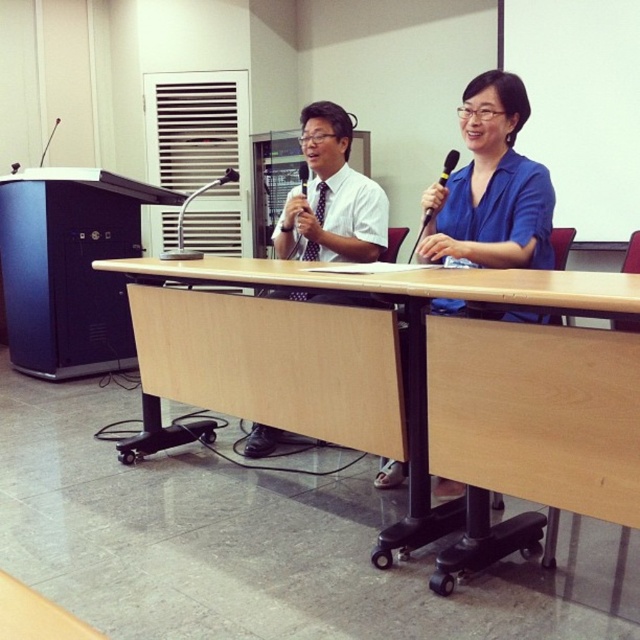
In the scene shown: You are an event planner setting up for a panel discussion. You need to ensure that the black plastic microphone at upper center is positioned so that it is directly above the light brown wood table at center. Is the current placement correct?

The light brown wood table at center is below the black plastic microphone at upper center, so the microphone is already positioned directly above the table.

You are attending a virtual meeting and need to adjust your camera to focus on the blue matte shirt at center and the black plastic microphone at upper center. Which object should you move the camera down to focus on?

The blue matte shirt at center is below the black plastic microphone at upper center, so to focus on it, you should move the camera down from the microphone.

Based on the photo, you are organizing a small workshop and need to place a black plastic microphone at upper center on the light brown wood table at center. Considering the table dimensions, will the microphone fit comfortably without hanging off the edge?

The light brown wood table at center has a width larger than the black plastic microphone at upper center, so the microphone will fit comfortably on the table without hanging off the edge.